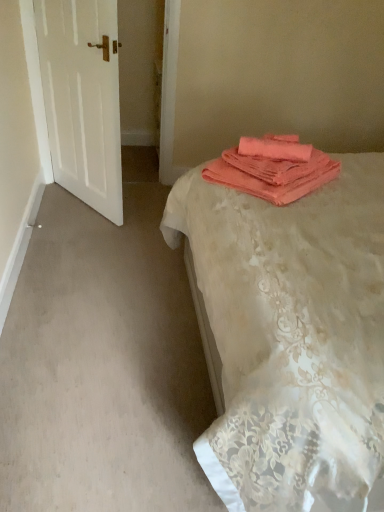
The height and width of the screenshot is (512, 384). In order to click on free spot to the right of white matte door at left in this screenshot , I will do `click(142, 202)`.